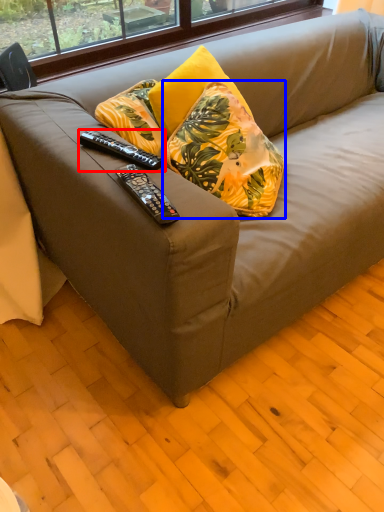
Question: Which object is closer to the camera taking this photo, remote control (highlighted by a red box) or pillow (highlighted by a blue box)?

Choices:
 (A) remote control
 (B) pillow

Answer: (A)